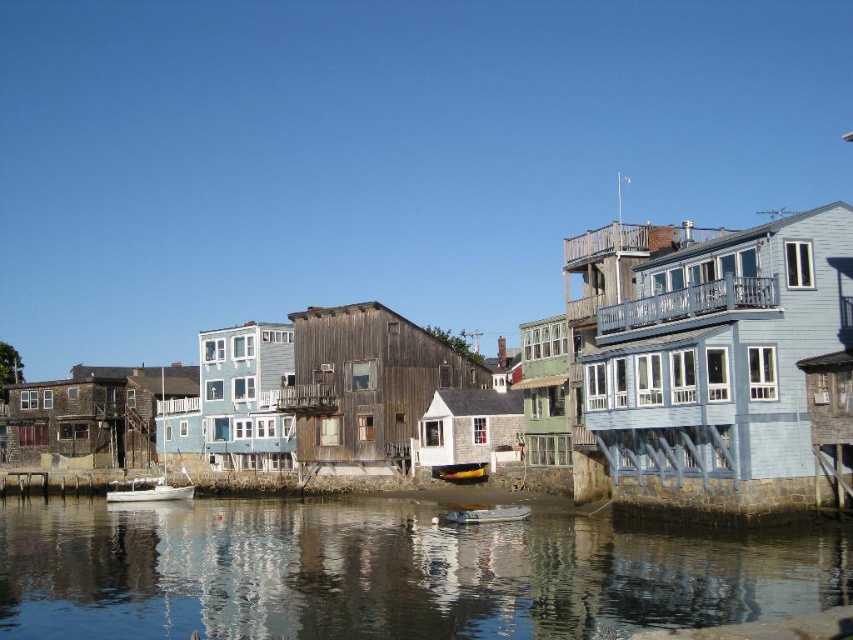
Who is lower down, white matte boat at lower left or yellow plastic boat at center?

white matte boat at lower left is below.

From the picture: Between white matte boat at lower left and yellow plastic boat at center, which one has less height?

Standing shorter between the two is yellow plastic boat at center.

Does point (115, 500) come closer to viewer compared to point (466, 470)?

That is False.

Locate an element on the screen. white matte boat at lower left is located at coordinates (146, 490).

Which is in front, point (305, 573) or point (462, 472)?

Point (305, 573)

Who is higher up, clear water at lower center or yellow plastic boat at center?

yellow plastic boat at center is higher up.

Is point (375, 516) more distant than point (468, 465)?

No, it is not.

Locate an element on the screen. The height and width of the screenshot is (640, 853). clear water at lower center is located at coordinates (384, 572).

Which is in front, point (514, 513) or point (453, 477)?

Point (514, 513)

This screenshot has width=853, height=640. I want to click on white glossy boat at center, so click(483, 515).